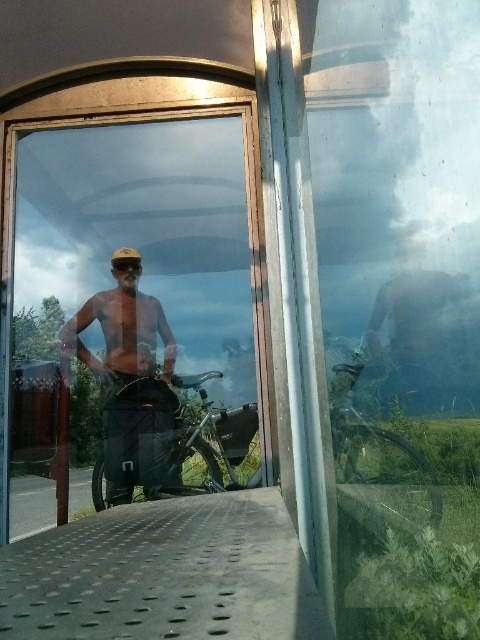
Is matte black bicycle at center below matte black goggles at center?

Yes, matte black bicycle at center is below matte black goggles at center.

Looking at this image, between matte black bicycle at center and matte black goggles at center, which one is positioned lower?

matte black bicycle at center is below.

At what (x,y) coordinates should I click in order to perform the action: click on matte black bicycle at center. Please return your answer as a coordinate pair (x, y). Looking at the image, I should click on (167, 442).

Who is shorter, matte black bicycle at center or shiny metallic helmet at center?

matte black bicycle at center is shorter.

Does point (105, 476) come farther from viewer compared to point (122, 301)?

That is False.

This screenshot has height=640, width=480. What do you see at coordinates (167, 442) in the screenshot?
I see `matte black bicycle at center` at bounding box center [167, 442].

I want to click on matte black bicycle at center, so click(167, 442).

Measure the distance between point (23,536) and camera.

Point (23,536) is 2.43 meters from camera.

Between point (94, 292) and point (153, 460), which one is positioned behind?

Point (94, 292)

Locate an element on the screen. The image size is (480, 640). transparent glass door at center is located at coordinates (130, 296).